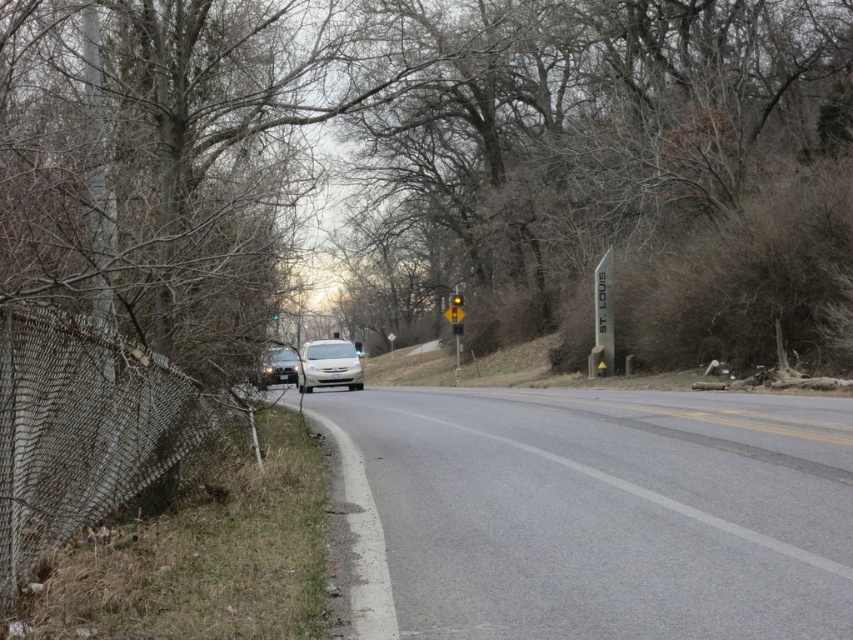
Who is taller, brown leafless tree at left or rusty mesh fence at left?

brown leafless tree at left is taller.

Which of these two, brown leafless tree at left or rusty mesh fence at left, stands shorter?

With less height is rusty mesh fence at left.

Consider the image. Who is more forward, (103, 109) or (189, 424)?

Point (189, 424) is in front.

The image size is (853, 640). What are the coordinates of `brown leafless tree at left` in the screenshot? It's located at (438, 168).

Who is taller, white matte van at center or yellow plastic traffic light at center?

white matte van at center

Describe the element at coordinates (328, 364) in the screenshot. Image resolution: width=853 pixels, height=640 pixels. I see `white matte van at center` at that location.

Find the location of `white matte van at center`. white matte van at center is located at coordinates (328, 364).

Can you confirm if white matte van at center is thinner than satin silver sedan at left?

Indeed, white matte van at center has a lesser width compared to satin silver sedan at left.

Does white matte van at center appear under satin silver sedan at left?

Yes, white matte van at center is below satin silver sedan at left.

Find the location of a particular element. This screenshot has height=640, width=853. white matte van at center is located at coordinates tap(328, 364).

Locate an element on the screen. Image resolution: width=853 pixels, height=640 pixels. white matte van at center is located at coordinates (328, 364).